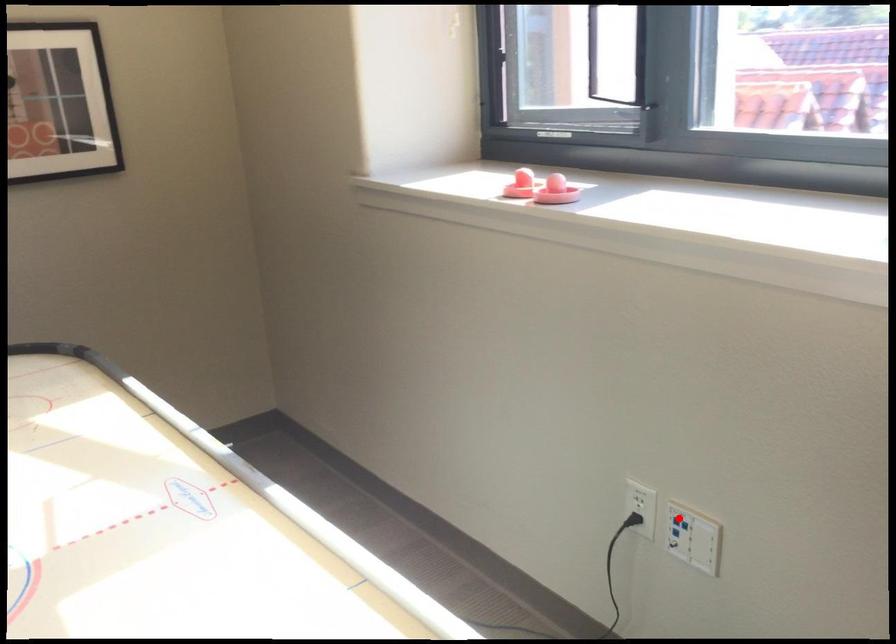
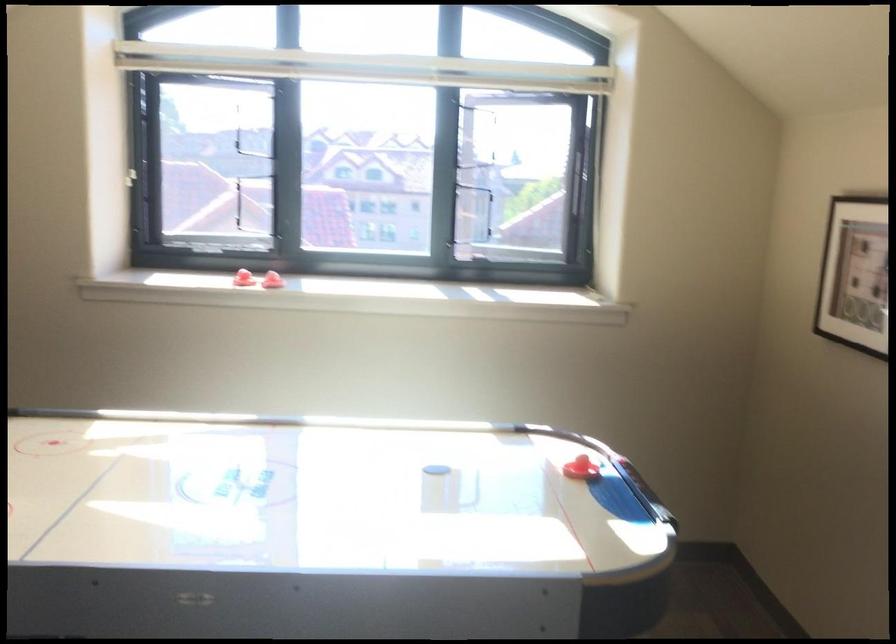
Question: I am providing you with two images of the same scene from different viewpoints. A red point is marked on the first image. At the location where the point appears in image 1, is it still visible in image 2?

Choices:
 (A) Yes
 (B) No

Answer: (B)